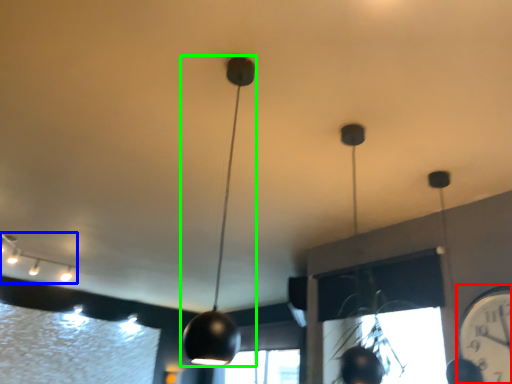
Question: Which object is positioned farthest from clock (highlighted by a red box)? Select from lamp (highlighted by a blue box) and lamp (highlighted by a green box).

Choices:
 (A) lamp
 (B) lamp

Answer: (A)